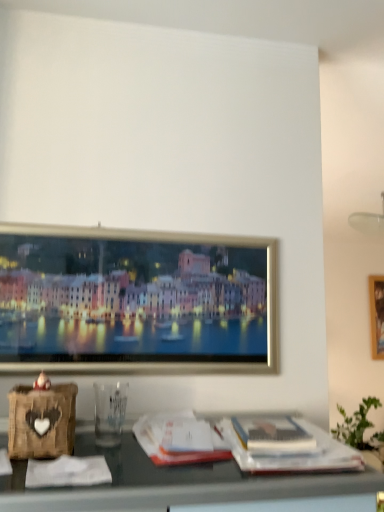
Question: Considering the relative positions of matte white magazine at lower right, which is the 2th magazine in left-to-right order, and white paper magazine at center, which is counted as the second magazine, starting from the right, in the image provided, is matte white magazine at lower right, which is the 2th magazine in left-to-right order, to the left of white paper magazine at center, which is counted as the second magazine, starting from the right, from the viewer's perspective?

Choices:
 (A) no
 (B) yes

Answer: (A)

Question: Does matte white magazine at lower right, the first magazine viewed from the right, have a greater height compared to white paper magazine at center, the first magazine viewed from the left?

Choices:
 (A) yes
 (B) no

Answer: (B)

Question: From a real-world perspective, is matte white magazine at lower right, the first magazine viewed from the right, on white paper magazine at center, which is counted as the second magazine, starting from the right?

Choices:
 (A) yes
 (B) no

Answer: (A)

Question: From the image's perspective, is matte white magazine at lower right, the first magazine viewed from the right, beneath white paper magazine at center, the first magazine viewed from the left?

Choices:
 (A) no
 (B) yes

Answer: (A)

Question: Can you confirm if matte white magazine at lower right, the first magazine viewed from the right, is positioned to the right of white paper magazine at center, which is counted as the second magazine, starting from the right?

Choices:
 (A) yes
 (B) no

Answer: (A)

Question: Is matte white magazine at lower right, the first magazine viewed from the right, oriented towards white paper magazine at center, which is counted as the second magazine, starting from the right?

Choices:
 (A) no
 (B) yes

Answer: (A)

Question: From a real-world perspective, is white paper magazine at center, which is counted as the second magazine, starting from the right, on top of matte white magazine at lower right, which is the 2th magazine in left-to-right order?

Choices:
 (A) yes
 (B) no

Answer: (B)

Question: From the image's perspective, is white paper magazine at center, which is counted as the second magazine, starting from the right, over matte white magazine at lower right, which is the 2th magazine in left-to-right order?

Choices:
 (A) yes
 (B) no

Answer: (B)

Question: Is the position of white paper magazine at center, which is counted as the second magazine, starting from the right, less distant than that of matte white magazine at lower right, which is the 2th magazine in left-to-right order?

Choices:
 (A) yes
 (B) no

Answer: (A)

Question: From a real-world perspective, is white paper magazine at center, which is counted as the second magazine, starting from the right, under matte white magazine at lower right, which is the 2th magazine in left-to-right order?

Choices:
 (A) no
 (B) yes

Answer: (B)

Question: Is white paper magazine at center, the first magazine viewed from the left, in contact with matte white magazine at lower right, the first magazine viewed from the right?

Choices:
 (A) yes
 (B) no

Answer: (B)

Question: Considering the relative sizes of white paper magazine at center, which is counted as the second magazine, starting from the right, and matte white magazine at lower right, which is the 2th magazine in left-to-right order, in the image provided, is white paper magazine at center, which is counted as the second magazine, starting from the right, taller than matte white magazine at lower right, which is the 2th magazine in left-to-right order,?

Choices:
 (A) no
 (B) yes

Answer: (B)

Question: Which is correct: white paper magazine at center, which is counted as the second magazine, starting from the right, is inside matte white magazine at lower right, which is the 2th magazine in left-to-right order, or outside of it?

Choices:
 (A) outside
 (B) inside

Answer: (A)